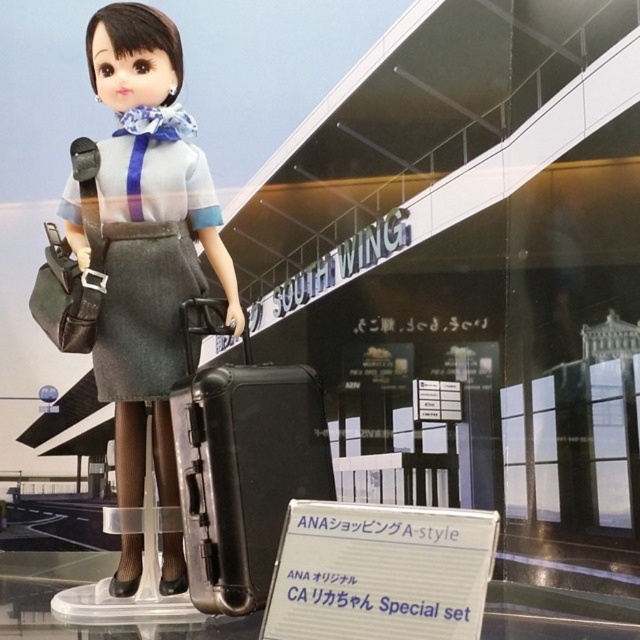
You are packing for a trip and need to know which item is larger between the black hard suitcase at center and the denim skirt at center. Which one should you choose if you need more space?

The black hard suitcase at center is bigger than the denim skirt at center, so you should choose the black hard suitcase at center if you need more space.

You are packing for a trip and need to choose between the matte black suitcase at lower center and the black hard suitcase at center. Based on their sizes, which one can hold more clothing?

The matte black suitcase at lower center is larger in size than the black hard suitcase at center, so it can hold more clothing.